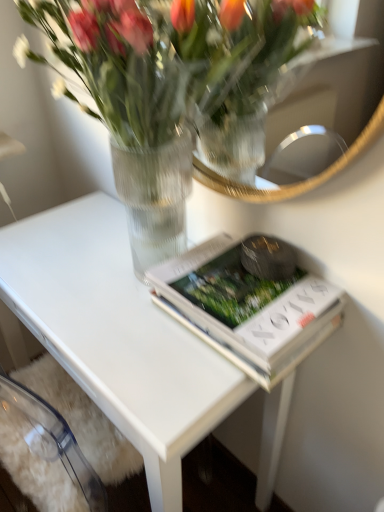
Locate an element on the screen. Image resolution: width=384 pixels, height=512 pixels. free space in front of clear glass vase at upper center is located at coordinates (132, 359).